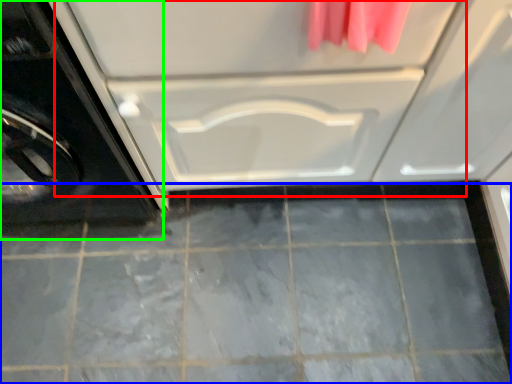
Question: Which is farther away from drawer (highlighted by a red box)? ceramic tile (highlighted by a blue box) or washing machine (highlighted by a green box)?

Choices:
 (A) ceramic tile
 (B) washing machine

Answer: (A)